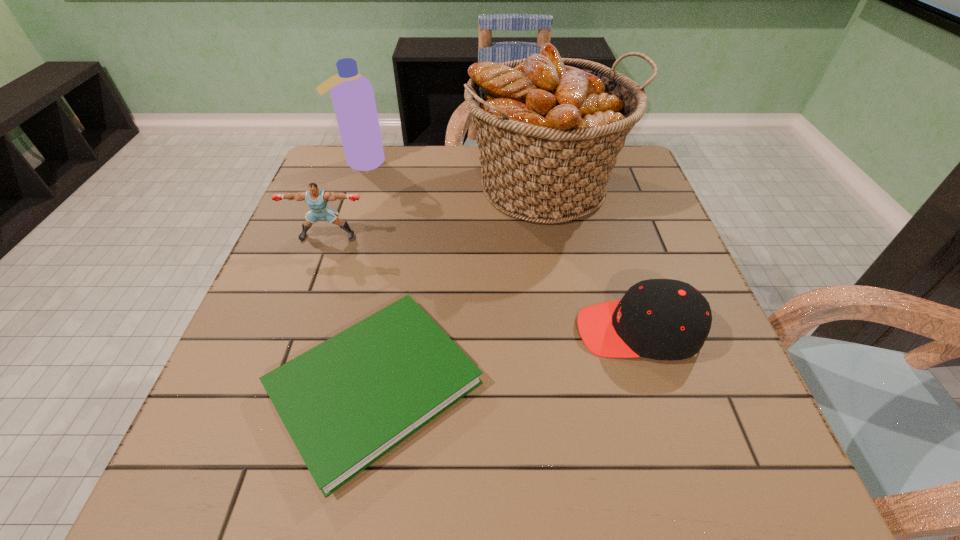
What are the coordinates of `free point located 0.140m on the front-facing side of the fourth tallest object` in the screenshot? It's located at (505, 330).

Where is `free space located 0.330m on the back of the paperback book`? free space located 0.330m on the back of the paperback book is located at coordinates (408, 206).

I want to click on basket at the far edge, so pyautogui.click(x=549, y=129).

The width and height of the screenshot is (960, 540). What are the coordinates of `shampoo located in the far edge section of the desktop` in the screenshot? It's located at (352, 94).

The height and width of the screenshot is (540, 960). In order to click on object that is at the near edge in this screenshot , I will do `click(348, 401)`.

You are a GUI agent. You are given a task and a screenshot of the screen. Output one action in this format:
    pyautogui.click(x=<x>, y=<y>)
    Task: Click on the shampoo located at the left edge
    Image resolution: width=960 pixels, height=540 pixels.
    Given the screenshot: What is the action you would take?
    pyautogui.click(x=352, y=94)

Image resolution: width=960 pixels, height=540 pixels. What are the coordinates of `puncher that is at the left edge` in the screenshot? It's located at pos(317,199).

At what (x,y) coordinates should I click in order to perform the action: click on paperback book present at the left edge. Please return your answer as a coordinate pair (x, y). Image resolution: width=960 pixels, height=540 pixels. Looking at the image, I should click on (348, 401).

The image size is (960, 540). Identify the location of basket situated at the right edge. (549, 129).

Find the location of a particular element. cap that is positioned at the right edge is located at coordinates (662, 319).